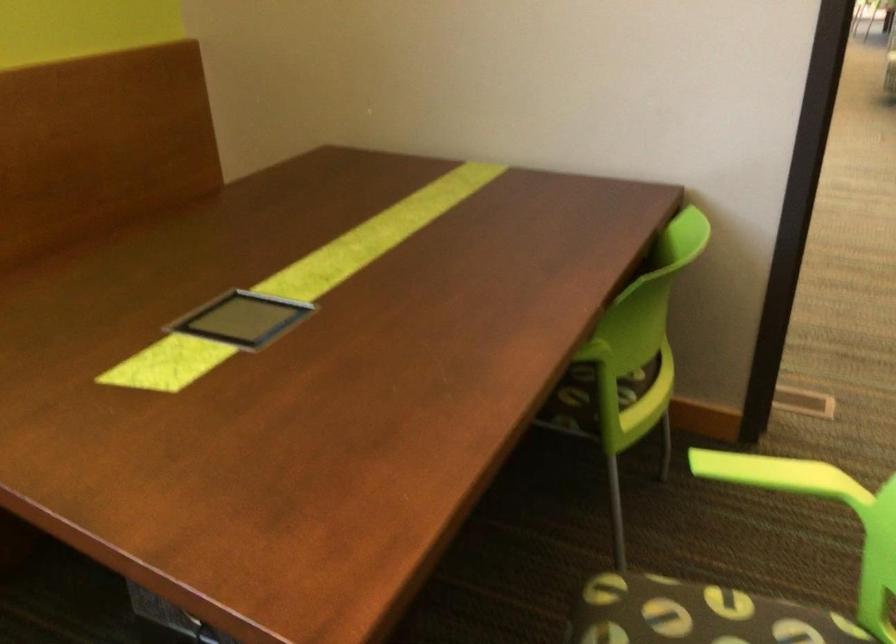
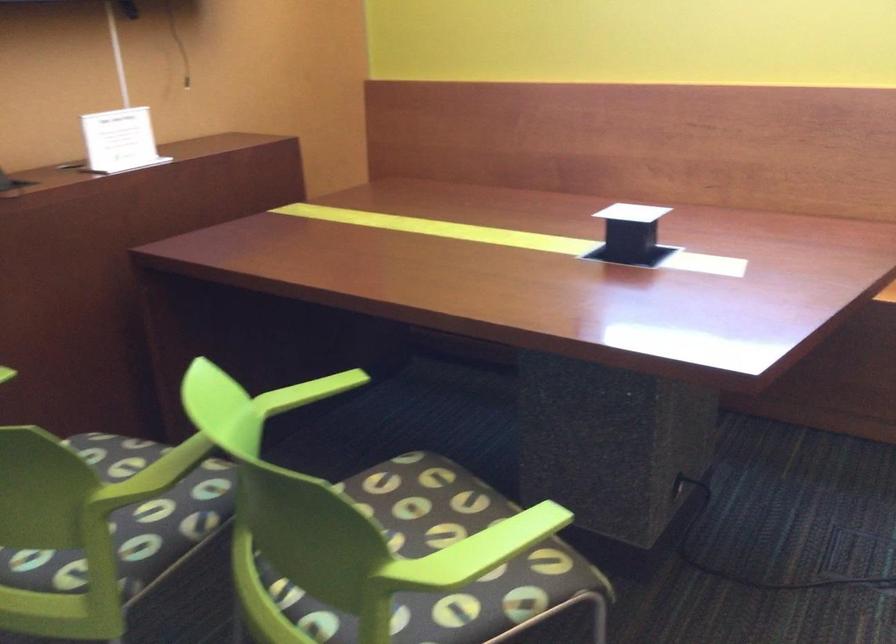
The images are taken continuously from a first-person perspective. In which direction is your viewpoint rotating?

The rotation direction of the camera is left-down.